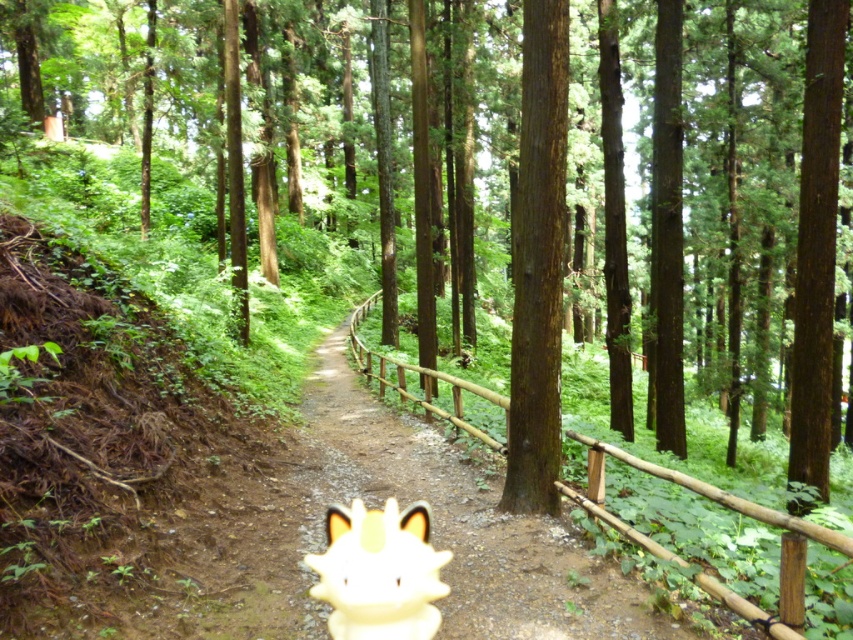
Identify the location of brown rough bark tree at center. The width and height of the screenshot is (853, 640). (538, 262).

In the scene shown: Does brown rough bark tree at center appear on the left side of white glossy figurine at center?

Incorrect, brown rough bark tree at center is not on the left side of white glossy figurine at center.

What do you see at coordinates (538, 262) in the screenshot? The height and width of the screenshot is (640, 853). I see `brown rough bark tree at center` at bounding box center [538, 262].

At what (x,y) coordinates should I click in order to perform the action: click on brown rough bark tree at center. Please return your answer as a coordinate pair (x, y). Image resolution: width=853 pixels, height=640 pixels. Looking at the image, I should click on (538, 262).